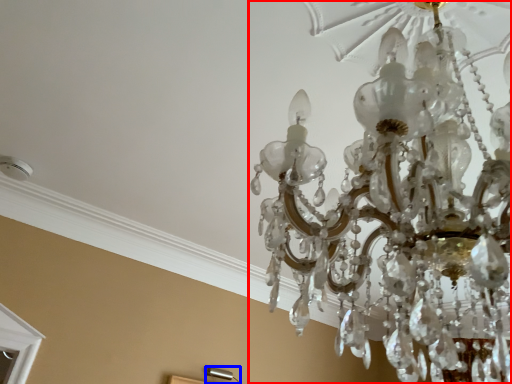
Question: Which point is further to the camera, lamp (highlighted by a red box) or lamp (highlighted by a blue box)?

Choices:
 (A) lamp
 (B) lamp

Answer: (B)